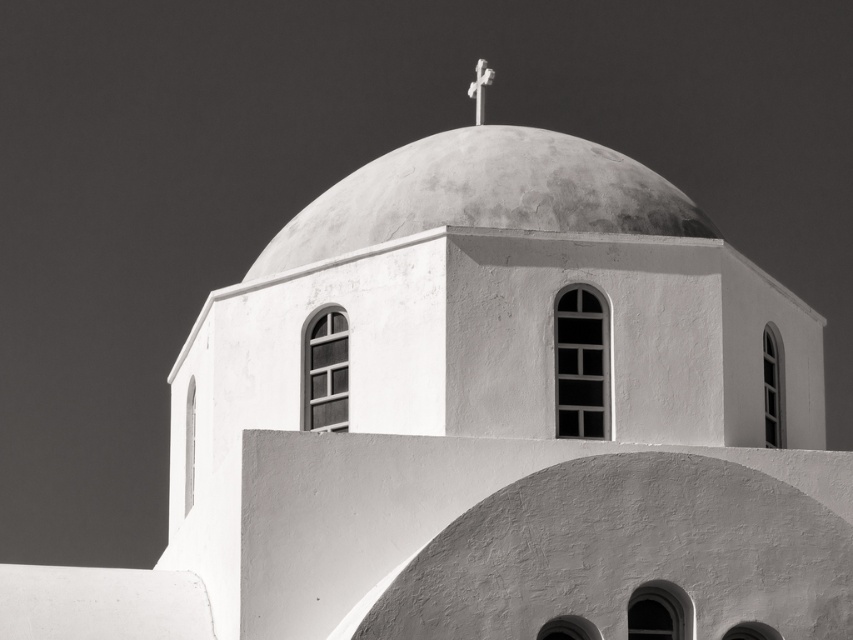
Question: Which object appears farthest from the camera in this image?

Choices:
 (A) smooth concrete dome at center
 (B) white wooden cross at top center

Answer: (B)

Question: Which of the following is the closest to the observer?

Choices:
 (A) white wooden cross at top center
 (B) smooth concrete dome at center

Answer: (B)

Question: Does smooth concrete dome at center appear under white wooden cross at top center?

Choices:
 (A) no
 (B) yes

Answer: (B)

Question: Which of the following is the farthest from the observer?

Choices:
 (A) white wooden cross at top center
 (B) smooth concrete dome at center

Answer: (A)

Question: Can you confirm if smooth concrete dome at center is wider than white wooden cross at top center?

Choices:
 (A) yes
 (B) no

Answer: (A)

Question: Does smooth concrete dome at center appear on the left side of white wooden cross at top center?

Choices:
 (A) yes
 (B) no

Answer: (A)